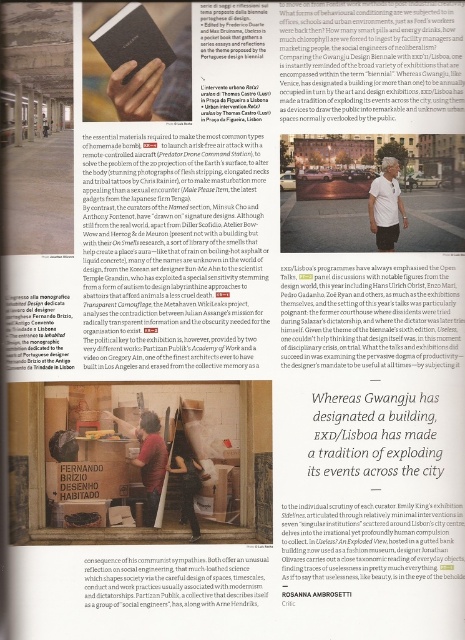
Can you confirm if matte black book at upper left is positioned to the right of wooden table at center?

No, matte black book at upper left is not to the right of wooden table at center.

Find the location of a particular element. matte black book at upper left is located at coordinates (131, 38).

Which is behind, point (112, 61) or point (159, 424)?

Point (159, 424)

I want to click on matte black book at upper left, so click(x=131, y=38).

Can you confirm if white cotton shirt at center is taller than wooden table at center?

In fact, white cotton shirt at center may be shorter than wooden table at center.

Is point (377, 214) positioned before point (146, 486)?

No, (377, 214) is further to viewer.

Identify the location of white cotton shirt at center. (385, 205).

From the picture: Who is more distant from viewer, [386,208] or [185,449]?

Point [185,449]

Which is more to the left, white cotton shirt at center or dark brown leather jacket at center?

Positioned to the left is dark brown leather jacket at center.

Between point (396, 186) and point (187, 456), which one is positioned behind?

The point (187, 456) is behind.

The width and height of the screenshot is (465, 640). What are the coordinates of `white cotton shirt at center` in the screenshot? It's located at [x=385, y=205].